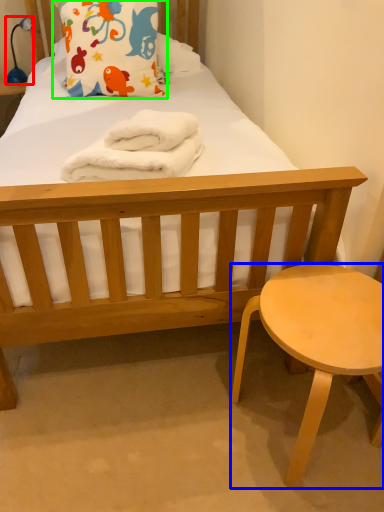
Question: Considering the real-world distances, which object is farthest from lamp (highlighted by a red box)? stool (highlighted by a blue box) or pillow (highlighted by a green box)?

Choices:
 (A) stool
 (B) pillow

Answer: (A)